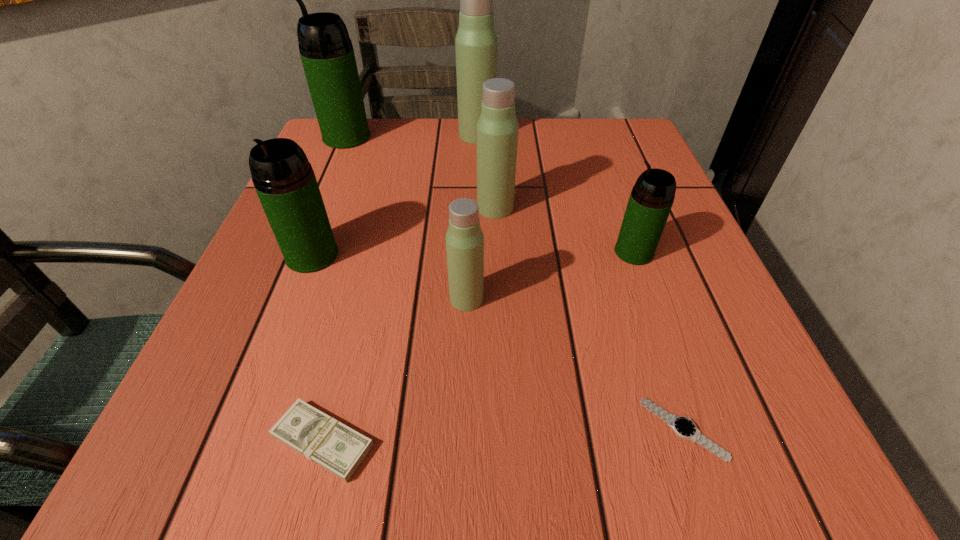
Find the location of `free spot that satisfies the following two spatial constraints: 1. on the back side of the money; 2. on the left side of the watch`. free spot that satisfies the following two spatial constraints: 1. on the back side of the money; 2. on the left side of the watch is located at coordinates (326, 429).

Locate an element on the screen. The height and width of the screenshot is (540, 960). free space that satisfies the following two spatial constraints: 1. on the front side of the farthest light thermos bottle; 2. on the right side of the watch is located at coordinates 474,429.

Where is `vacant point that satisfies the following two spatial constraints: 1. from the spout of the smallest green thermos bottle; 2. on the front side of the shortest object`? Image resolution: width=960 pixels, height=540 pixels. vacant point that satisfies the following two spatial constraints: 1. from the spout of the smallest green thermos bottle; 2. on the front side of the shortest object is located at coordinates (697, 429).

Find the location of a particular element. vacant point that satisfies the following two spatial constraints: 1. from the spout of the second smallest green thermos bottle; 2. on the left side of the nearest light thermos bottle is located at coordinates (296, 299).

The width and height of the screenshot is (960, 540). I want to click on vacant position in the image that satisfies the following two spatial constraints: 1. from the spout of the biggest green thermos bottle; 2. on the right side of the third farthest thermos bottle, so click(x=317, y=208).

Find the location of a particular element. vacant space that satisfies the following two spatial constraints: 1. from the spout of the second biggest green thermos bottle; 2. on the left side of the shortest object is located at coordinates (245, 429).

You are a GUI agent. You are given a task and a screenshot of the screen. Output one action in this format:
    pyautogui.click(x=<x>, y=<y>)
    Task: Click on the free space in the image that satisfies the following two spatial constraints: 1. on the front side of the watch; 2. on the right side of the sixth farthest object
    
    Given the screenshot: What is the action you would take?
    [463, 429]